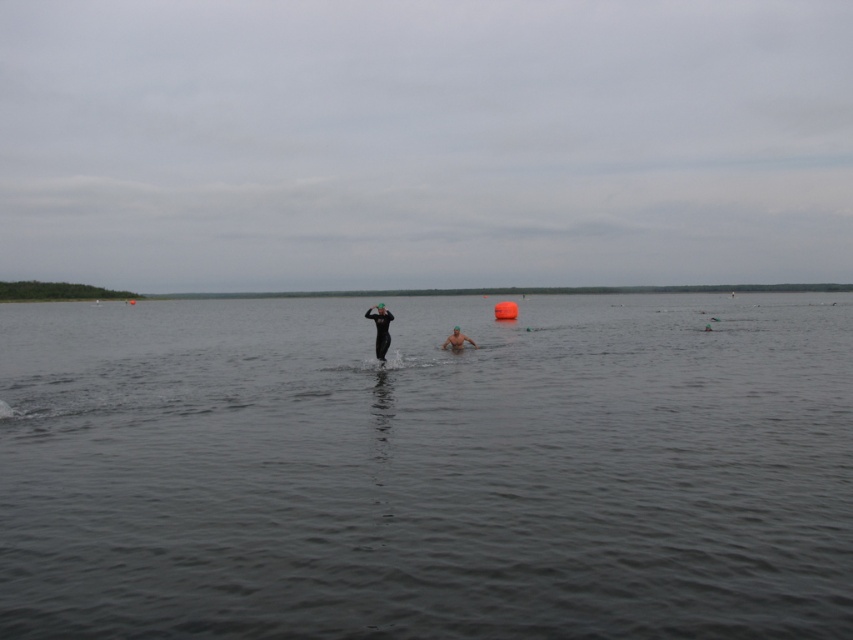
You are a photographer trying to capture the scene from the shore. You notice the dark gray water at center and the black matte wetsuit at center. Which object appears wider in the image?

The dark gray water at center appears wider than the black matte wetsuit at center because its width surpasses the latter.

You are observing the scene from the shore. Which object is closer to you between the dark gray water at center and the black matte wetsuit at center?

The dark gray water at center is closer to you because it is positioned in front of the black matte wetsuit at center.